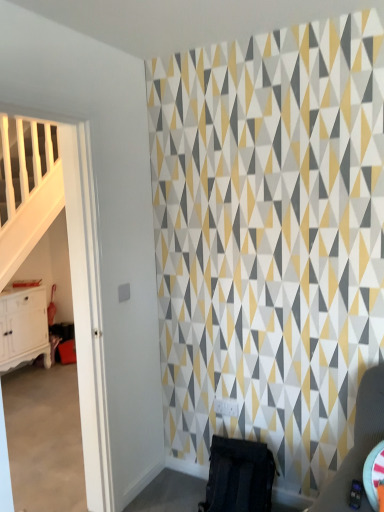
Question: In terms of height, does black fabric swivel chair at lower center look taller or shorter compared to white glossy cabinet at left?

Choices:
 (A) short
 (B) tall

Answer: (A)

Question: From a real-world perspective, is black fabric swivel chair at lower center positioned above or below white glossy cabinet at left?

Choices:
 (A) below
 (B) above

Answer: (A)

Question: Is point (253, 493) closer or farther from the camera than point (16, 330)?

Choices:
 (A) farther
 (B) closer

Answer: (B)

Question: Visually, is white glossy cabinet at left positioned to the left or to the right of black fabric swivel chair at lower center?

Choices:
 (A) left
 (B) right

Answer: (A)

Question: Considering their positions, is white glossy cabinet at left located in front of or behind black fabric swivel chair at lower center?

Choices:
 (A) behind
 (B) front

Answer: (A)

Question: In terms of width, does white glossy cabinet at left look wider or thinner when compared to black fabric swivel chair at lower center?

Choices:
 (A) wide
 (B) thin

Answer: (B)

Question: From a real-world perspective, is white glossy cabinet at left physically located above or below black fabric swivel chair at lower center?

Choices:
 (A) above
 (B) below

Answer: (A)